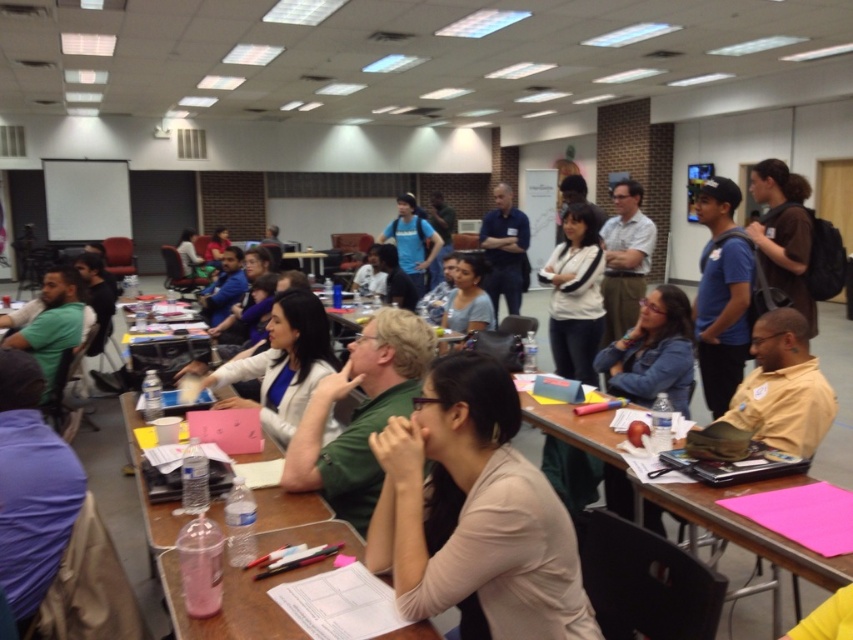
Question: Which of the following is the farthest from the observer?

Choices:
 (A) (428, 592)
 (B) (569, 412)
 (C) (312, 376)

Answer: (B)

Question: Does clear plastic tray at center appear under white glossy shirt at center?

Choices:
 (A) yes
 (B) no

Answer: (A)

Question: Which of these objects is positioned farthest from the clear plastic tray at center?

Choices:
 (A) light beige fabric shirt at center
 (B) brown wooden table at lower right

Answer: (B)

Question: Is clear plastic tray at center wider than brown wooden table at lower right?

Choices:
 (A) yes
 (B) no

Answer: (A)

Question: Which of these objects is positioned farthest from the clear plastic tray at center?

Choices:
 (A) light beige fabric shirt at center
 (B) white glossy shirt at center
 (C) brown wooden table at lower right

Answer: (C)

Question: Is clear plastic tray at center below white glossy shirt at center?

Choices:
 (A) no
 (B) yes

Answer: (B)